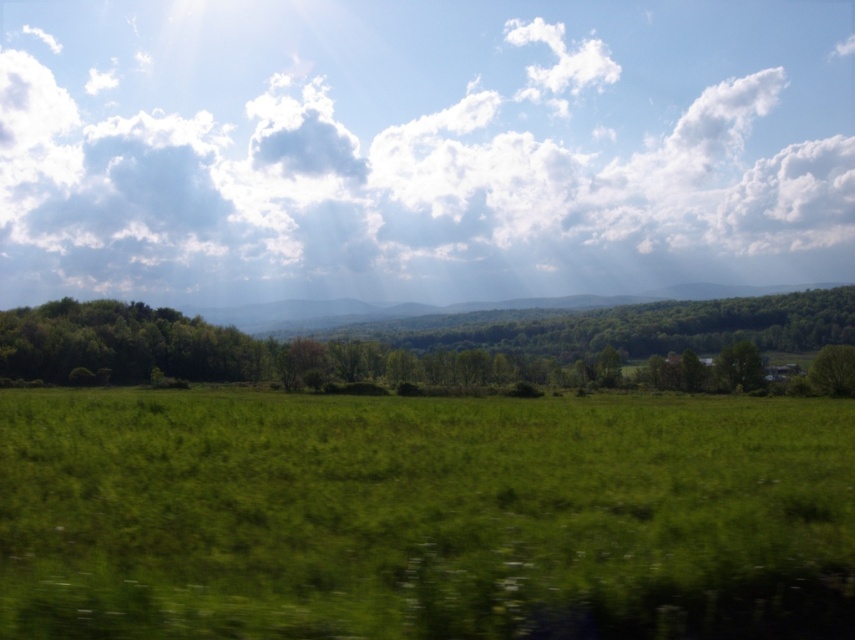
You are standing in the rural landscape shown in the image. If you want to walk towards the green leafy trees at left, which direction should you face?

The green leafy trees at left are located at coordinates 0.531 on the x axis and 0.690 on the y axis. Since the x coordinate is 0.531, which is to the left of the center point of the image, you should face towards the left direction to walk towards them.